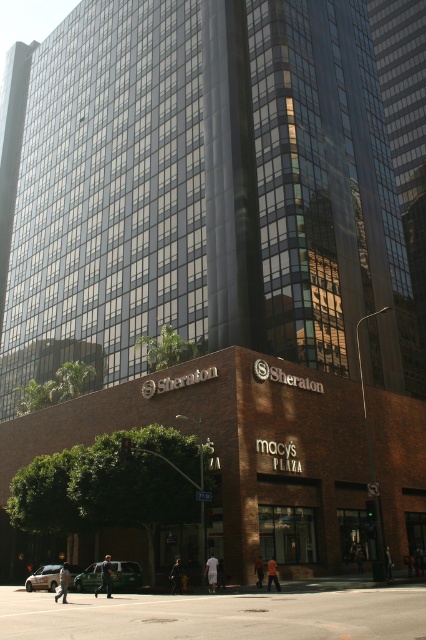
You are a delivery person needing to park a 2.5 meter wide van in the space between the metallic silver car at lower left and the silver metallic sedan at lower left. Can the van fit in that space?

The metallic silver car at lower left is narrower than the silver metallic sedan at lower left. However, the combined width of both vehicles would determine the available space between them. Since the exact distance between them isn

You are a delivery person needing to park your 12.5 feet long truck in the space between the metallic silver car at lower left and the silver metallic sedan at lower left. Can your truck fit in that space?

The space between the metallic silver car at lower left and the silver metallic sedan at lower left is 13.70 feet. Since your truck is 12.5 feet long, it can fit in the space as there is enough room.